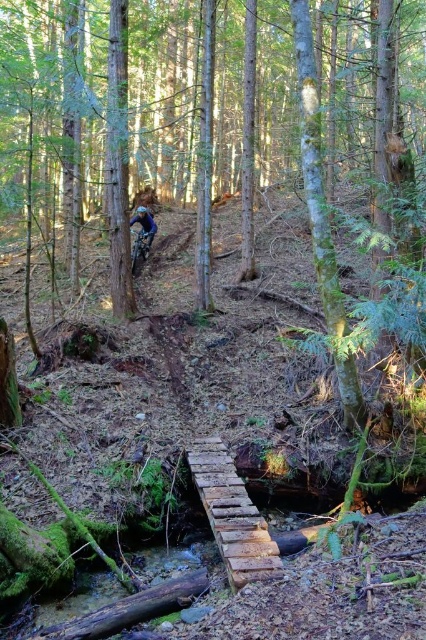
You are a hiker carrying a blue fabric helmet at upper center and need to cross the rustic wooden bridge at center. Can you safely walk across the bridge with the helmet in hand?

The rustic wooden bridge at center is wider than the blue fabric helmet at upper center, so yes, you can safely walk across the bridge while carrying the helmet in hand as there is enough space.

You are a hiker who has just arrived at the forest scene. You see a shiny metallic mountain bike at center. Based on its position, can you estimate whether the bike is closer to the bridge or the stream?

The shiny metallic mountain bike at center is positioned at coordinates point (140, 248). Since the bridge spans over the stream, the bike is closer to the bridge than the stream.

You are standing at the wooden bridge in the forest scene. You notice two points marked in the image. Which point, point (238, 573) or point (132, 262), is closer to your current position?

Point (238, 573) is closer to the camera than point (132, 262), so it is closer to your current position.